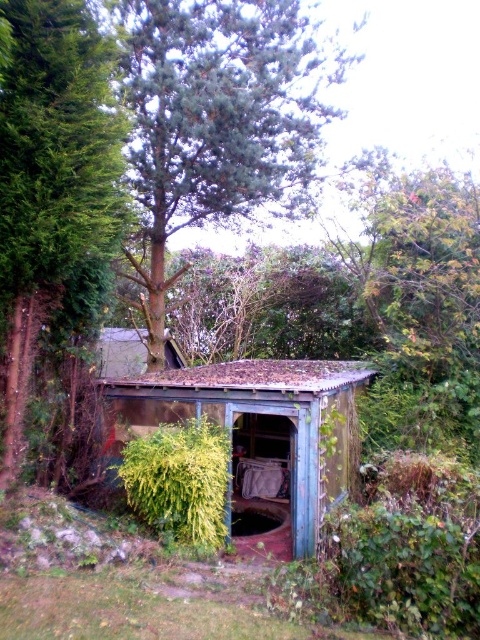
You are standing in the garden and want to know which object is taller between the green leafy tree at left and the weathered wood shed at center. Can you determine this based on the scene?

The green leafy tree at left is taller than the weathered wood shed at center.

You are standing in the garden and want to know which object is wider between the green leafy tree at left and the weathered wood shed at center. Can you determine which one is wider?

The green leafy tree at left is wider than the weathered wood shed at center.

You are standing in the garden and want to take a photo of the weathered wood shed at center without the green leafy tree at upper center blocking the view. What should you do?

The green leafy tree at upper center is much taller than the weathered wood shed at center, so you should move to a lower position to avoid the tree blocking the view.